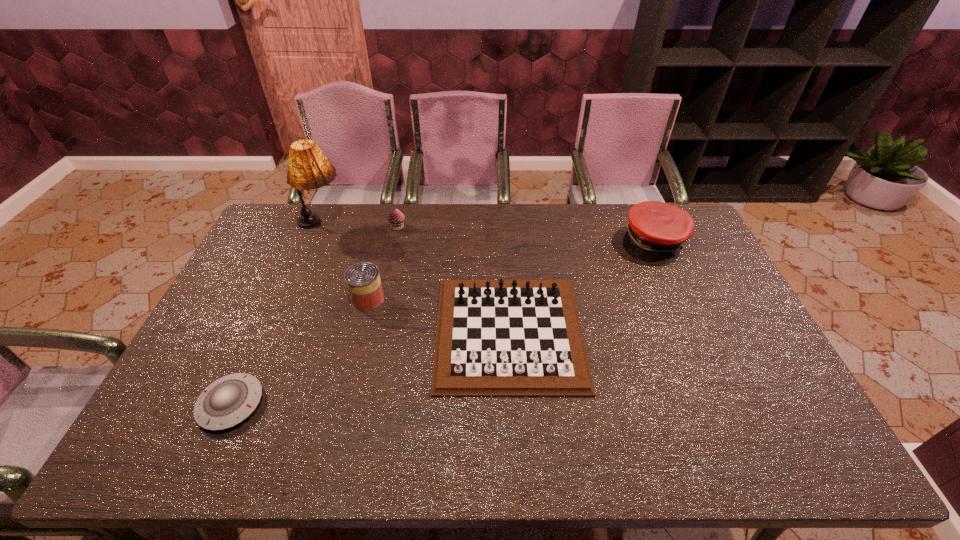
You are a GUI agent. You are given a task and a screenshot of the screen. Output one action in this format:
    pyautogui.click(x=<x>, y=<y>)
    Task: Click on the object that is positioned at the near left corner
    
    Given the screenshot: What is the action you would take?
    pyautogui.click(x=229, y=400)

Locate an element on the screen. The image size is (960, 540). object that is at the far right corner is located at coordinates (656, 229).

At what (x,y) coordinates should I click in order to perform the action: click on vacant space at the far edge of the desktop. Please return your answer as a coordinate pair (x, y). Image resolution: width=960 pixels, height=540 pixels. Looking at the image, I should click on (430, 210).

Locate an element on the screen. This screenshot has height=540, width=960. vacant space at the near edge of the desktop is located at coordinates (323, 453).

In the image, there is a desktop. In order to click on vacant space at the left edge in this screenshot , I will do `click(249, 305)`.

This screenshot has width=960, height=540. I want to click on free space at the right edge, so tap(762, 351).

Locate an element on the screen. The image size is (960, 540). unoccupied position between the cupcake and the gameboard is located at coordinates (453, 280).

Find the location of a particular element. free space between the cupcake and the gameboard is located at coordinates (453, 280).

Find the location of a particular element. The width and height of the screenshot is (960, 540). empty space that is in between the can and the shortest object is located at coordinates (300, 352).

This screenshot has width=960, height=540. I want to click on vacant area that lies between the second object from right to left and the saucer, so click(371, 368).